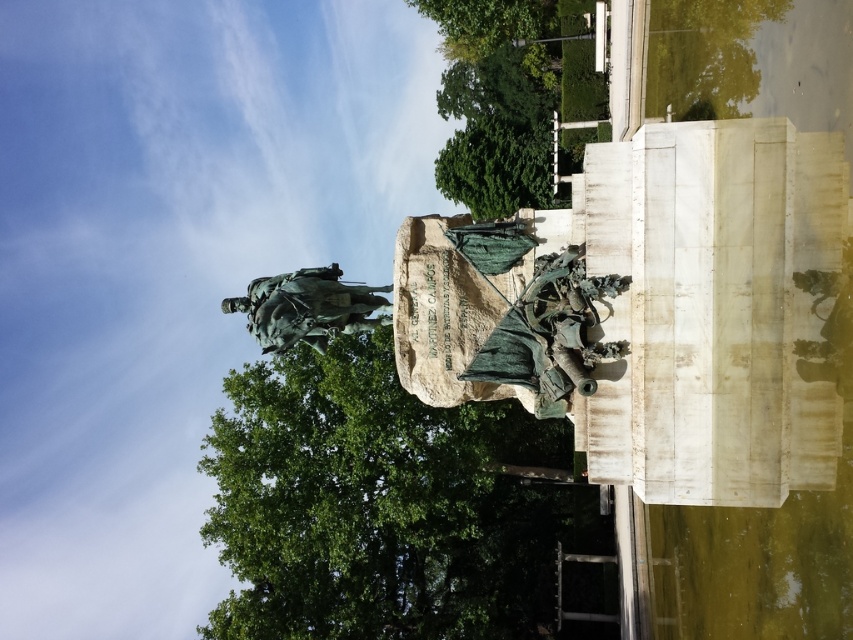
Who is higher up, green leafy tree at center or green leafy tree at upper center?

green leafy tree at upper center

Does green leafy tree at center have a larger size compared to green leafy tree at upper center?

Indeed, green leafy tree at center has a larger size compared to green leafy tree at upper center.

Does point (383, 541) lie in front of point (447, 156)?

Yes, point (383, 541) is closer to viewer.

Identify the location of green leafy tree at center. (376, 504).

Can you confirm if green leafy tree at upper center is shorter than bronze statue at center?

Incorrect, green leafy tree at upper center's height does not fall short of bronze statue at center's.

Where is `green leafy tree at upper center`? The width and height of the screenshot is (853, 640). green leafy tree at upper center is located at coordinates (496, 100).

Does green leafy tree at center appear under bronze statue at center?

Indeed, green leafy tree at center is positioned under bronze statue at center.

Is point (482, 417) behind point (308, 312)?

Yes, it is.

Measure the distance between point (276,484) and camera.

Point (276,484) and camera are 227.47 feet apart from each other.

What are the coordinates of `green leafy tree at center` in the screenshot? It's located at (376, 504).